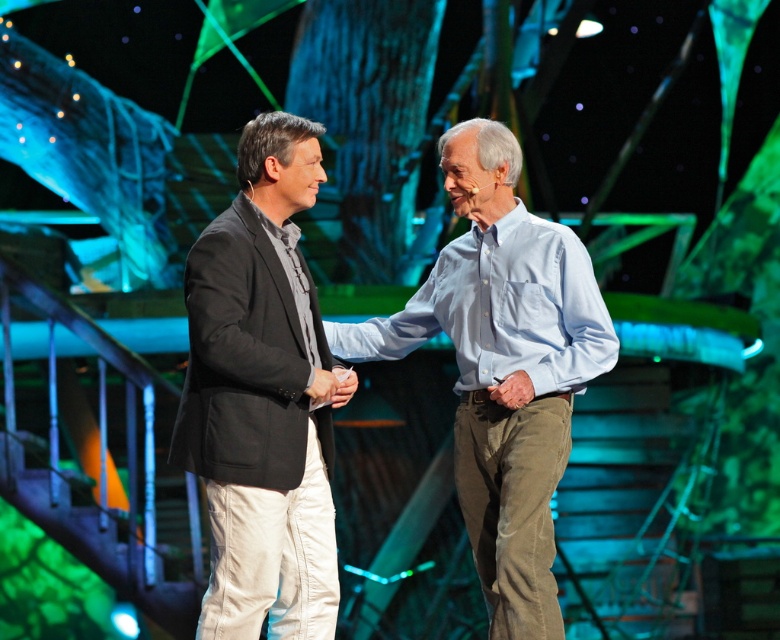
Is matte black blazer at center closer to camera compared to light blue cotton shirt at center?

Yes, matte black blazer at center is in front of light blue cotton shirt at center.

Which of these two, matte black blazer at center or light blue cotton shirt at center, stands shorter?

matte black blazer at center is shorter.

Between point (261, 234) and point (520, 442), which one is positioned behind?

The point (520, 442) is behind.

Locate an element on the screen. matte black blazer at center is located at coordinates (261, 397).